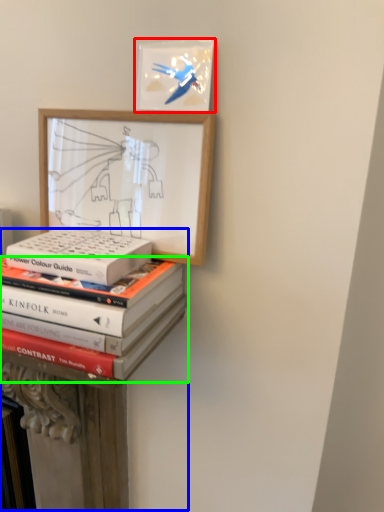
Question: Which object is positioned farthest from picture frame (highlighted by a red box)? Select from bookshelf (highlighted by a blue box) and book (highlighted by a green box).

Choices:
 (A) bookshelf
 (B) book

Answer: (A)